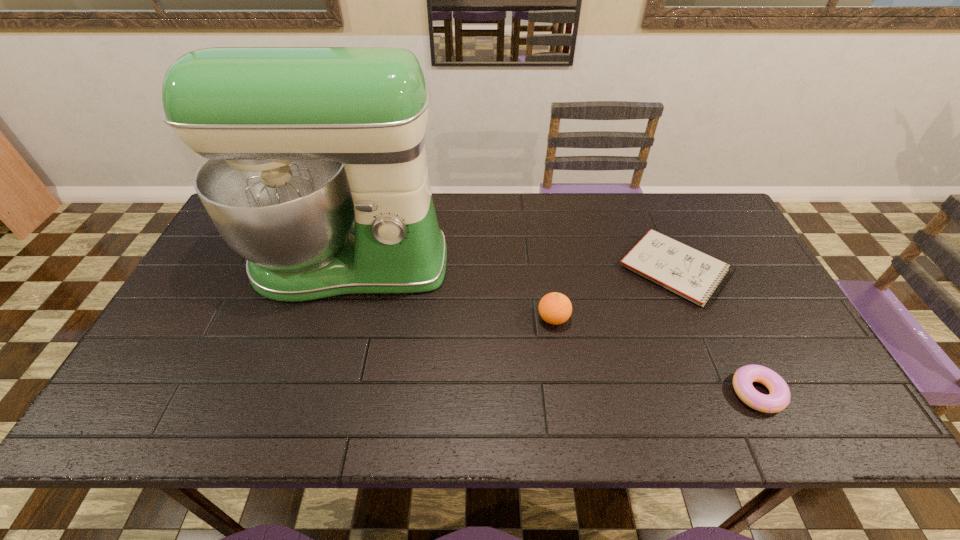
Find the location of a particular element. The width and height of the screenshot is (960, 540). vacant space located 0.140m on the front of the shortest object is located at coordinates (712, 356).

The width and height of the screenshot is (960, 540). What are the coordinates of `mixer present at the far edge` in the screenshot? It's located at (299, 140).

Identify the location of notepad situated at the far edge. This screenshot has height=540, width=960. (690, 273).

Locate an element on the screen. The height and width of the screenshot is (540, 960). object situated at the near edge is located at coordinates (779, 398).

Identify the location of object that is positioned at the left edge. The image size is (960, 540). (299, 140).

At what (x,y) coordinates should I click in order to perform the action: click on doughnut positioned at the right edge. Please return your answer as a coordinate pair (x, y). The height and width of the screenshot is (540, 960). Looking at the image, I should click on (779, 398).

Find the location of a particular element. The image size is (960, 540). notepad positioned at the right edge is located at coordinates (690, 273).

Where is `object located in the far left corner section of the desktop`? This screenshot has height=540, width=960. object located in the far left corner section of the desktop is located at coordinates (299, 140).

Image resolution: width=960 pixels, height=540 pixels. Find the location of `object situated at the far right corner`. object situated at the far right corner is located at coordinates (690, 273).

Where is `object that is at the near right corner`? object that is at the near right corner is located at coordinates (779, 398).